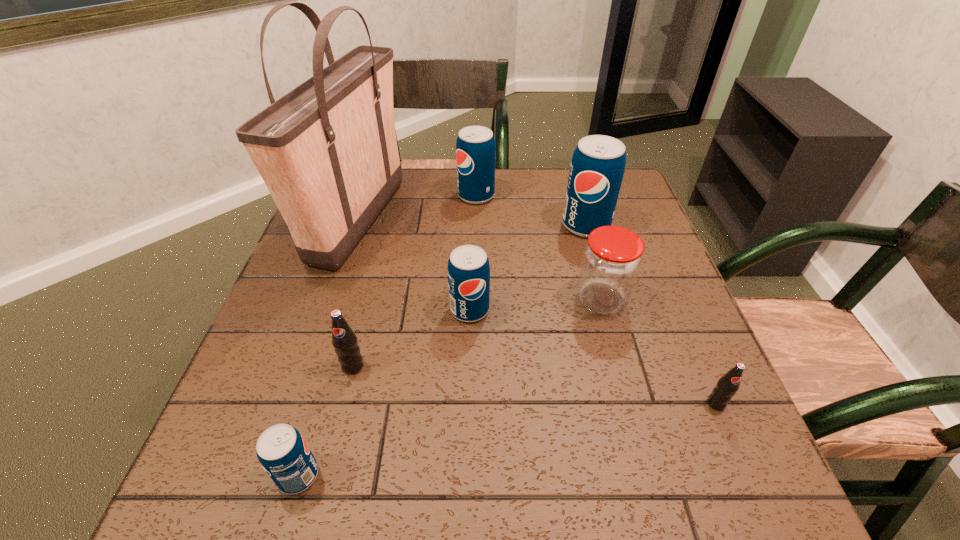
Identify the location of vacant space that satisfies the following two spatial constraints: 1. on the front side of the biggest blue pop; 2. on the left side of the farthest pop. The width and height of the screenshot is (960, 540). (476, 225).

Locate an element on the screen. Image resolution: width=960 pixels, height=540 pixels. free space in the image that satisfies the following two spatial constraints: 1. on the back side of the third farthest blue pop; 2. on the right side of the biggest blue pop is located at coordinates (471, 225).

Identify the location of free location that satisfies the following two spatial constraints: 1. on the back side of the second tallest pop; 2. on the left side of the third biggest blue pop. (472, 195).